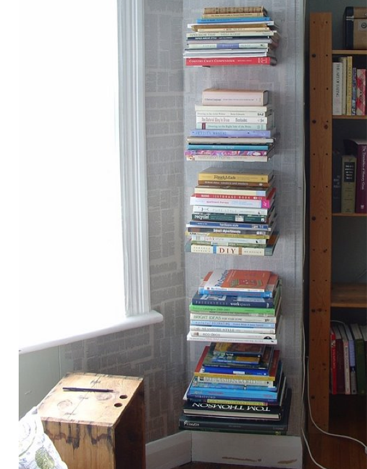
The width and height of the screenshot is (367, 469). In order to click on right side of window frame in this screenshot , I will do `click(132, 147)`.